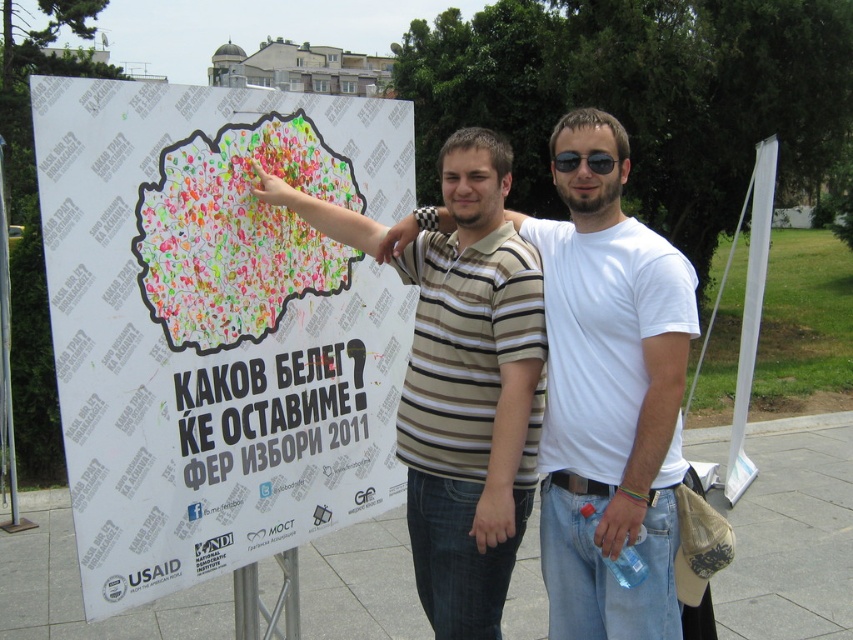
Question: Which of the following is the farthest from the observer?

Choices:
 (A) sunglasses at center
 (B) white paper poster at left
 (C) brown striped polo shirt at center

Answer: (A)

Question: Does white paper poster at left have a greater width compared to brown striped polo shirt at center?

Choices:
 (A) yes
 (B) no

Answer: (B)

Question: Where is white paper poster at left located in relation to brown striped polo shirt at center in the image?

Choices:
 (A) above
 (B) below

Answer: (A)

Question: Based on their relative distances, which object is farther from the sunglasses at center?

Choices:
 (A) white paper poster at left
 (B) brown striped polo shirt at center

Answer: (A)

Question: Does white paper poster at left have a larger size compared to sunglasses at center?

Choices:
 (A) no
 (B) yes

Answer: (B)

Question: Estimate the real-world distances between objects in this image. Which object is farther from the white paper poster at left?

Choices:
 (A) sunglasses at center
 (B) brown striped polo shirt at center

Answer: (A)